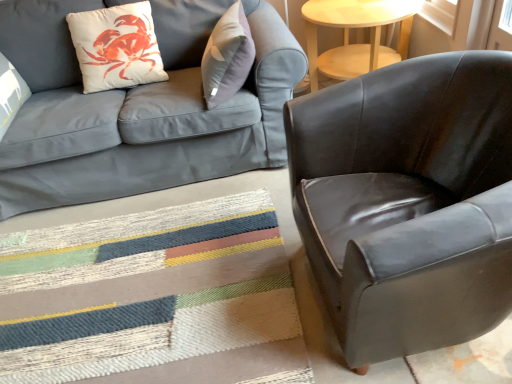
Question: In terms of size, does glossy leather armchair at right appear bigger or smaller than light wood round table at upper right?

Choices:
 (A) small
 (B) big

Answer: (B)

Question: Do you think glossy leather armchair at right is within light wood round table at upper right, or outside of it?

Choices:
 (A) outside
 (B) inside

Answer: (A)

Question: Which object is positioned closest to the white matte throw pillow at upper left?

Choices:
 (A) textured woven mat at lower center
 (B) light wood round table at upper right
 (C) matte gray fabric couch at upper left
 (D) glossy leather armchair at right

Answer: (C)

Question: Which object is positioned farthest from the glossy leather armchair at right?

Choices:
 (A) light wood round table at upper right
 (B) matte gray fabric couch at upper left
 (C) textured woven mat at lower center
 (D) white matte throw pillow at upper left

Answer: (D)